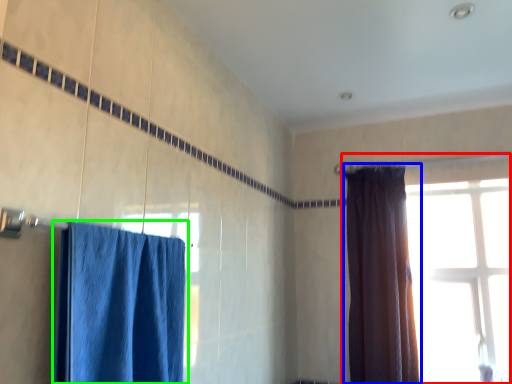
Question: Considering the real-world distances, which object is closest to window (highlighted by a red box)? curtain (highlighted by a blue box) or curtain (highlighted by a green box).

Choices:
 (A) curtain
 (B) curtain

Answer: (A)